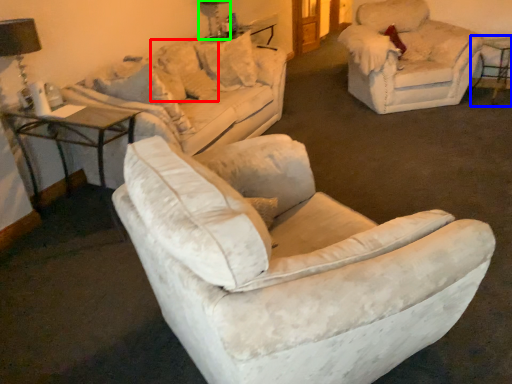
Question: Estimate the real-world distances between objects in this image. Which object is closer to pillow (highlighted by a red box), bar stool (highlighted by a blue box) or table lamp (highlighted by a green box)?

Choices:
 (A) bar stool
 (B) table lamp

Answer: (B)